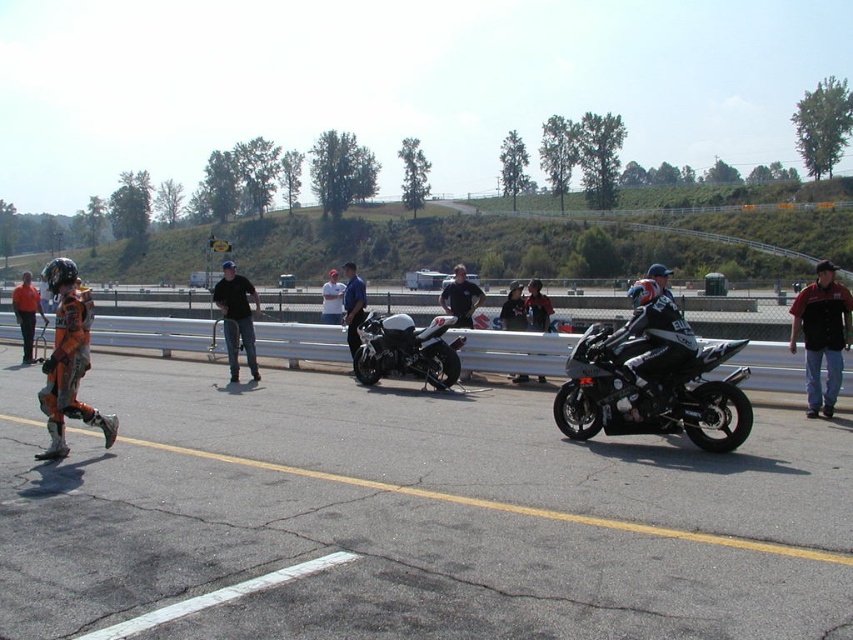
Question: Is shiny black motorcycle at center right smaller than orange racing suit at center?

Choices:
 (A) yes
 (B) no

Answer: (A)

Question: In this image, where is black leather jacket at right located relative to orange protective suit at left?

Choices:
 (A) above
 (B) below

Answer: (B)

Question: Which of the following is the closest to the observer?

Choices:
 (A) asphalt at lower center
 (B) orange protective suit at left
 (C) orange racing suit at center

Answer: (A)

Question: Which is farther from the black cotton shirt at center?

Choices:
 (A) shiny black motorcycle at center right
 (B) black leather jacket at right
 (C) asphalt at lower center
 (D) matte black motorcycle at center

Answer: (B)

Question: Which point appears farthest from the camera in this image?

Choices:
 (A) (409, 360)
 (B) (24, 314)
 (C) (225, 339)
 (D) (347, 288)

Answer: (B)

Question: Does black leather jacket at right appear over matte blue shirt at center?

Choices:
 (A) no
 (B) yes

Answer: (A)